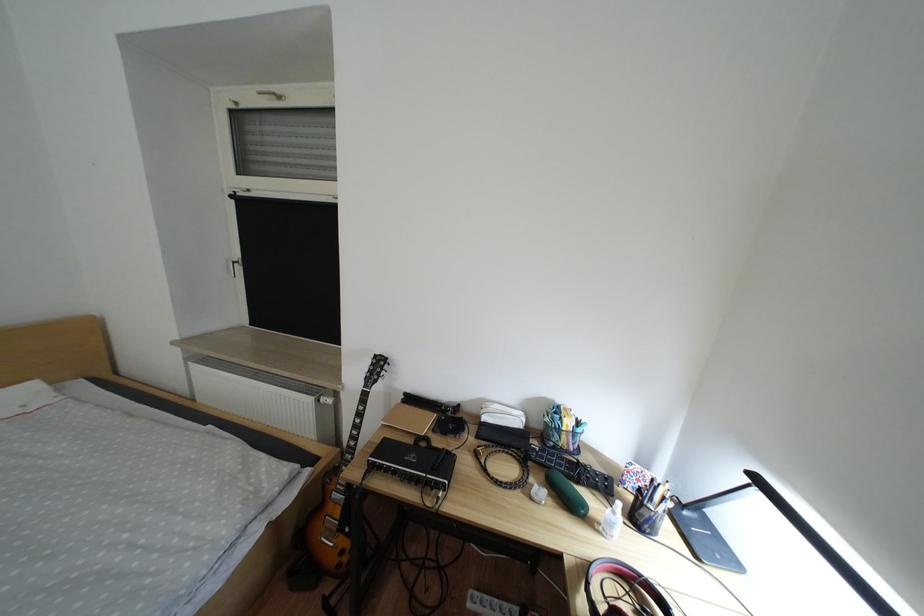
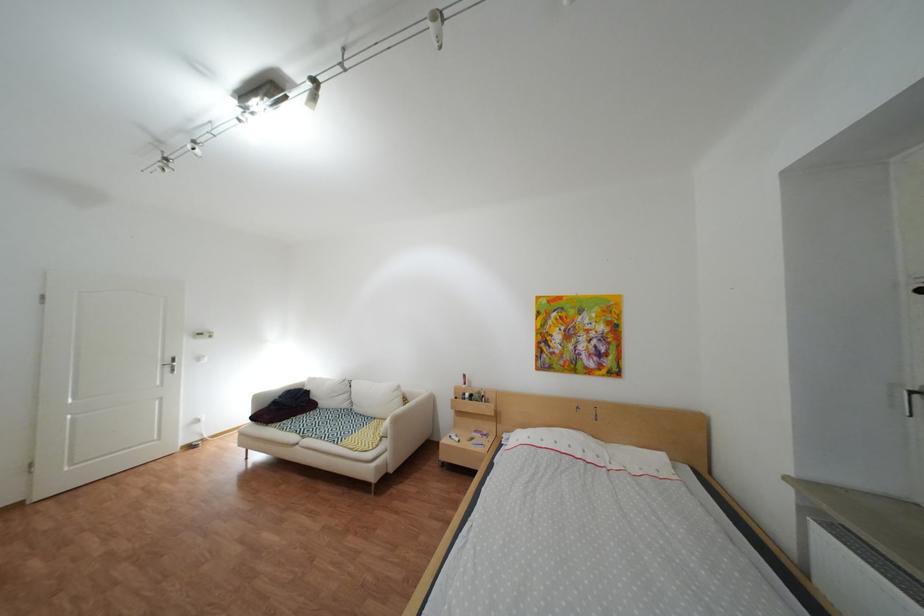
Question: The images are taken continuously from a first-person perspective. In which direction is your viewpoint rotating?

Choices:
 (A) Left
 (B) Right
 (C) Up
 (D) Down

Answer: (A)